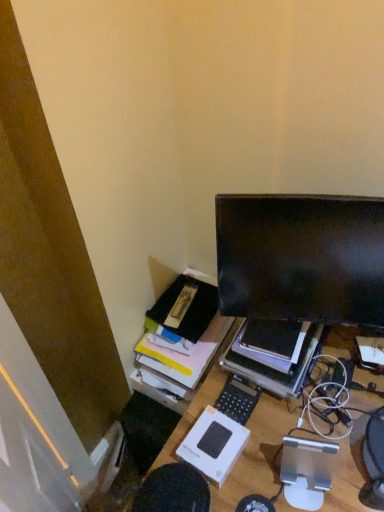
I want to click on vacant area on top of black matte monitor at upper right (from a real-world perspective), so click(276, 339).